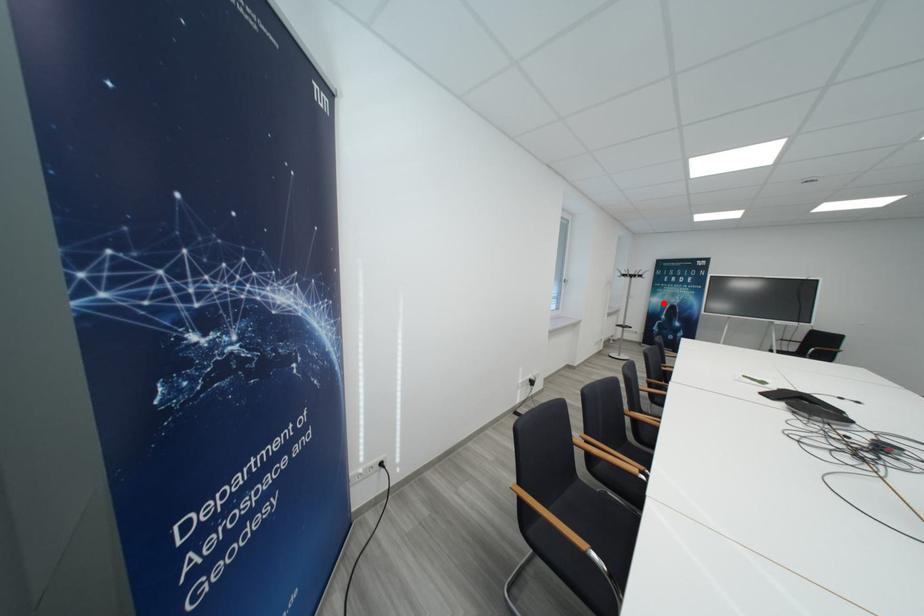
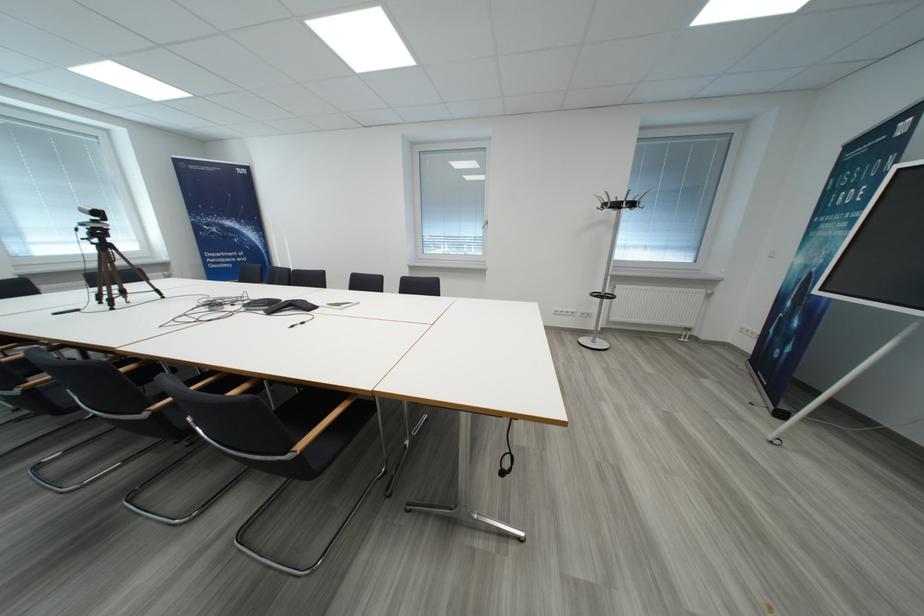
Question: I am providing you with two images of the same scene from different viewpoints. A red point is marked on the first image. At the location where the point appears in image 1, is it still visible in image 2?

Choices:
 (A) Yes
 (B) No

Answer: (A)